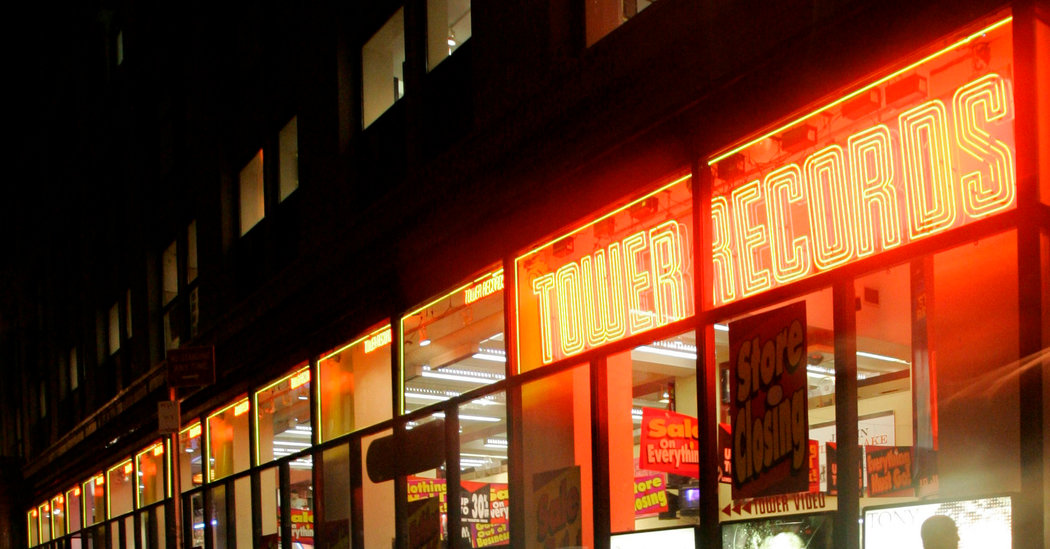
Identify the location of tower video sign inside store. (775, 511).